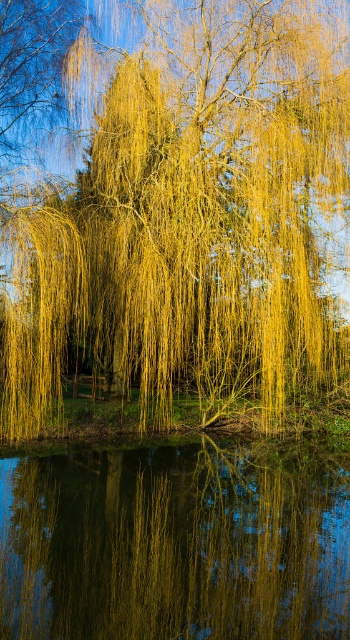
From the picture: Which is more to the left, yellow-green silky willow at center or wooden park bench at center?

wooden park bench at center

Between yellow-green silky willow at center and wooden park bench at center, which one has more height?

With more height is yellow-green silky willow at center.

The width and height of the screenshot is (350, 640). Describe the element at coordinates (193, 224) in the screenshot. I see `yellow-green silky willow at center` at that location.

Locate an element on the screen. yellow-green silky willow at center is located at coordinates (193, 224).

Is smooth reflective water at center smaller than wooden park bench at center?

No.

Does smooth reflective water at center appear on the right side of wooden park bench at center?

Correct, you'll find smooth reflective water at center to the right of wooden park bench at center.

Identify the location of smooth reflective water at center. (175, 545).

Where is `smooth reflective water at center`? smooth reflective water at center is located at coordinates (175, 545).

Does yellow-green silky willow at center appear on the right side of smooth reflective water at center?

Correct, you'll find yellow-green silky willow at center to the right of smooth reflective water at center.

This screenshot has width=350, height=640. What are the coordinates of `yellow-green silky willow at center` in the screenshot? It's located at (193, 224).